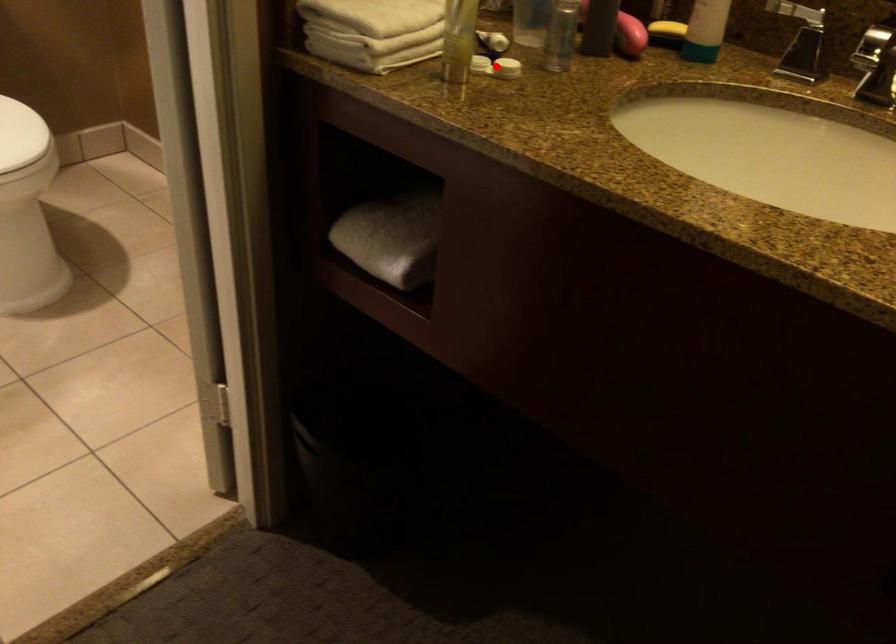
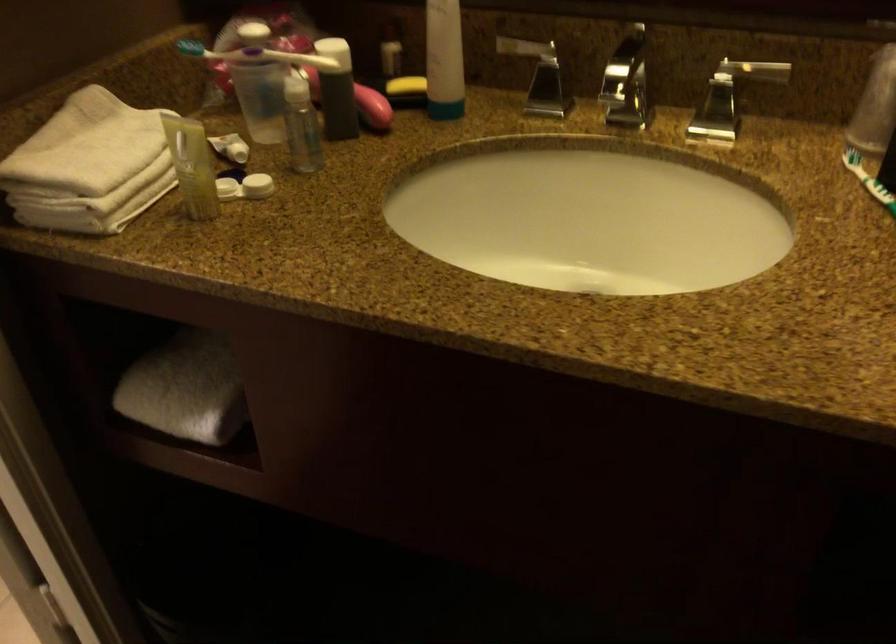
Question: I am providing you with two images of the same scene from different viewpoints. Given a red point in image1, look at the same physical point in image2. Is it:

Choices:
 (A) Closer to the viewpoint
 (B) Farther from the viewpoint

Answer: (A)